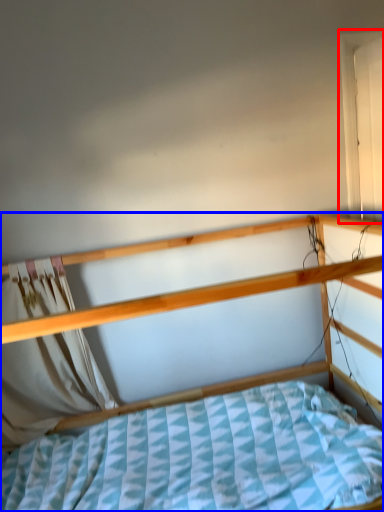
Question: Among these objects, which one is farthest to the camera, window (highlighted by a red box) or bed (highlighted by a blue box)?

Choices:
 (A) window
 (B) bed

Answer: (A)